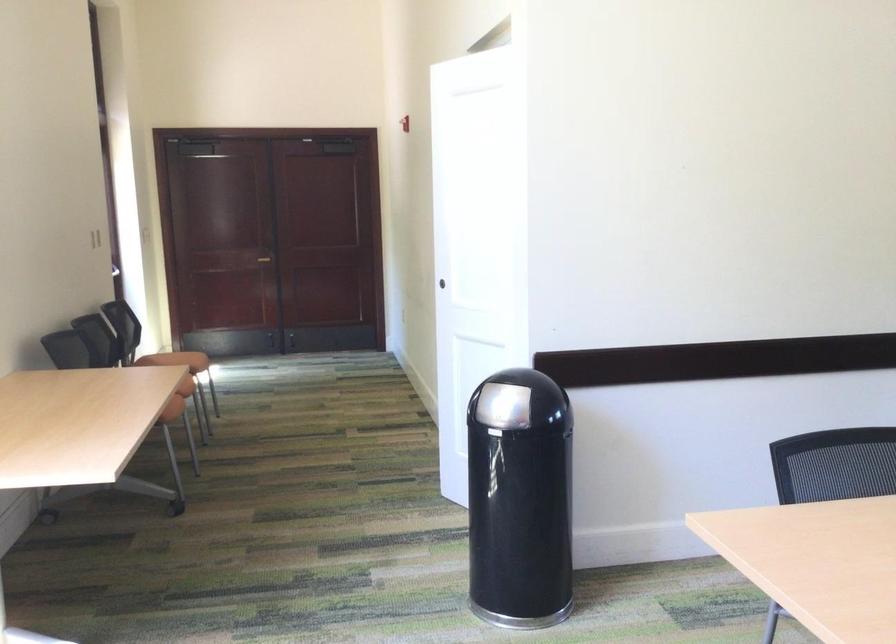
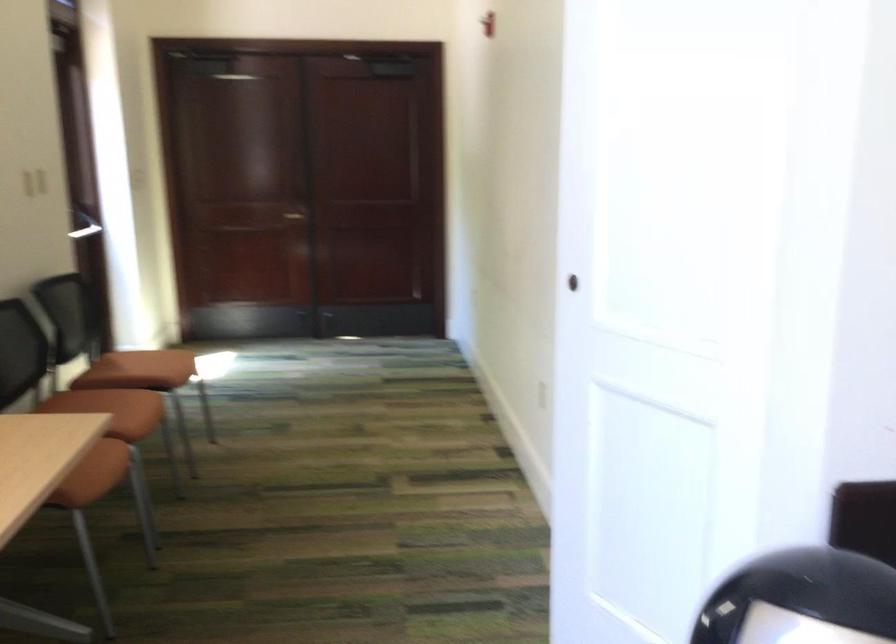
In the second image, find the point that corresponds to the point at 319,216 in the first image.

(364, 182)